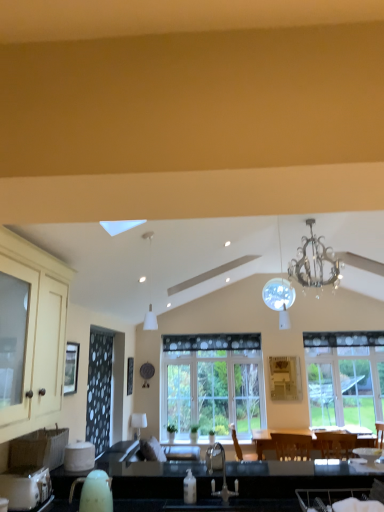
Question: In the image, is clear glass window at center, which is the 2th window in left-to-right order, on the left side or the right side of velvet dark brown armchair at lower right?

Choices:
 (A) left
 (B) right

Answer: (B)

Question: Considering the positions of clear glass window at center, which ranks as the 1th window in right-to-left order, and velvet dark brown armchair at lower right in the image, is clear glass window at center, which ranks as the 1th window in right-to-left order, taller or shorter than velvet dark brown armchair at lower right?

Choices:
 (A) short
 (B) tall

Answer: (B)

Question: Estimate the real-world distances between objects in this image. Which object is farther from the matte cream cabinet at left?

Choices:
 (A) velvet dark brown armchair at lower right
 (B) clear glass window at center, the 2th window when ordered from right to left
 (C) white glossy toaster at lower left
 (D) black matte sink at lower center
 (E) silver metallic chandelier at upper center, which ranks as the first light fixture in back-to-front order

Answer: (B)

Question: Which of these objects is positioned closest to the white glossy lampshade at upper center?

Choices:
 (A) black matte sink at lower center
 (B) white glossy toaster at lower left
 (C) matte cream cabinet at left
 (D) silver metallic chandelier at upper center, marked as the second light fixture in a front-to-back arrangement
 (E) velvet dark brown armchair at lower right

Answer: (A)